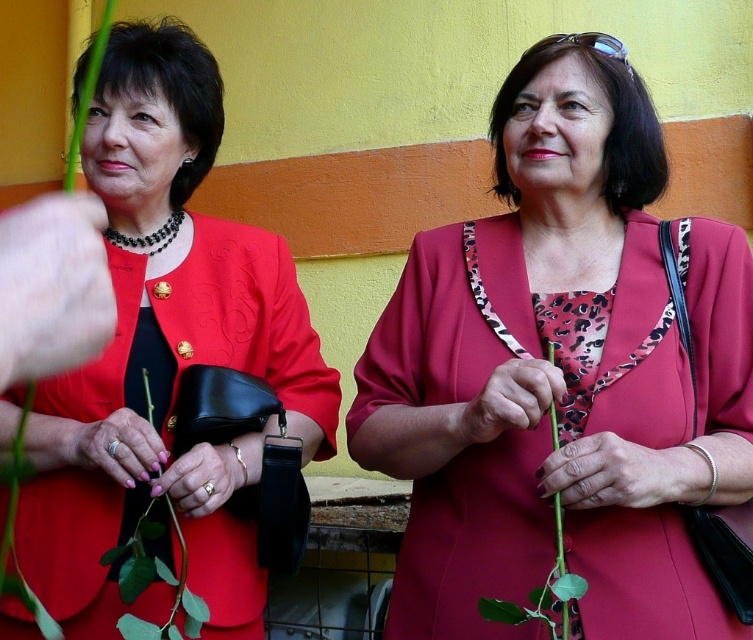
You are a florist arranging a bouquet for a client who wants the tallest possible flower. You have two options in the image, the green stem at center and the green matte flower at center. Which one should you choose?

The green stem at center is much taller than the green matte flower at center, so you should choose the green stem at center for the tallest flower.

You are a photographer setting up a shoot in the scene described. You want to ensure the matte red dress at center is visible against the green matte plant at center. Based on their positions, will the dress be clearly visible?

The matte red dress at center is in front of the green matte plant at center, so it will be clearly visible against the background.